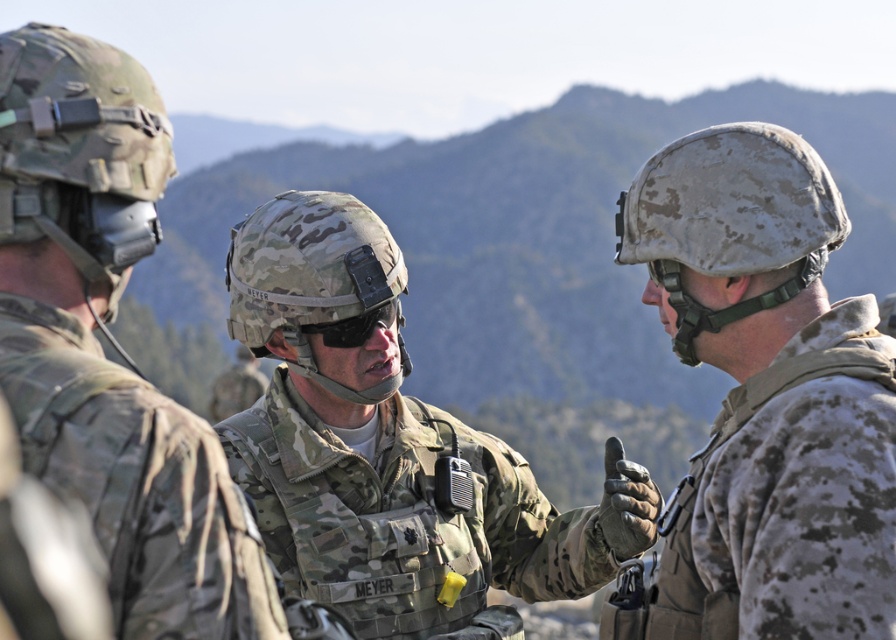
Question: Is camouflage uniform at right to the left of camo uniform at center from the viewer's perspective?

Choices:
 (A) yes
 (B) no

Answer: (B)

Question: Among these points, which one is nearest to the camera?

Choices:
 (A) (393, 572)
 (B) (872, 428)
 (C) (162, 550)

Answer: (C)

Question: Among these objects, which one is nearest to the camera?

Choices:
 (A) camo uniform at center
 (B) camouflage uniform at left

Answer: (B)

Question: Is camouflage uniform at right positioned before camo uniform at center?

Choices:
 (A) yes
 (B) no

Answer: (A)

Question: Which of the following is the farthest from the observer?

Choices:
 (A) pos(83,68)
 (B) pos(843,620)
 (C) pos(479,573)

Answer: (C)

Question: Is camouflage uniform at right wider than camouflage uniform at left?

Choices:
 (A) yes
 (B) no

Answer: (A)